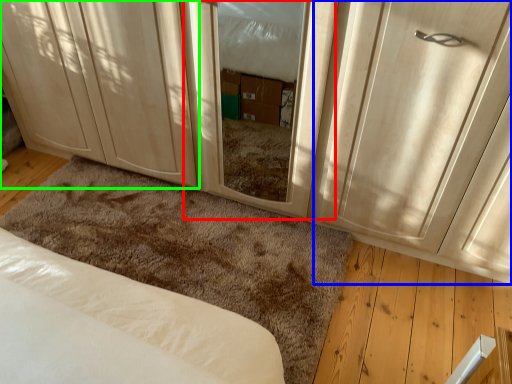
Question: Which object is positioned farthest from screen door (highlighted by a red box)? Select from door (highlighted by a blue box) and cabinetry (highlighted by a green box).

Choices:
 (A) door
 (B) cabinetry

Answer: (B)